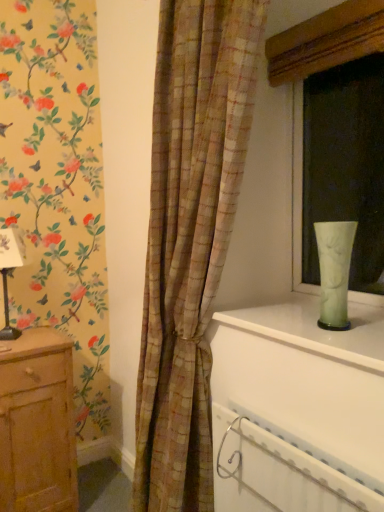
Question: Can you confirm if wooden chest of drawers at left is bigger than plaid fabric curtain at center?

Choices:
 (A) no
 (B) yes

Answer: (A)

Question: Is wooden chest of drawers at left facing towards plaid fabric curtain at center?

Choices:
 (A) yes
 (B) no

Answer: (A)

Question: Is wooden chest of drawers at left wider than plaid fabric curtain at center?

Choices:
 (A) yes
 (B) no

Answer: (A)

Question: Is wooden chest of drawers at left thinner than plaid fabric curtain at center?

Choices:
 (A) no
 (B) yes

Answer: (A)

Question: Considering the relative positions of wooden chest of drawers at left and plaid fabric curtain at center in the image provided, is wooden chest of drawers at left in front of plaid fabric curtain at center?

Choices:
 (A) yes
 (B) no

Answer: (B)

Question: In terms of size, does white plastic radiator at lower right appear bigger or smaller than plaid fabric curtain at center?

Choices:
 (A) big
 (B) small

Answer: (B)

Question: Is point tap(279, 445) closer or farther from the camera than point tap(147, 485)?

Choices:
 (A) farther
 (B) closer

Answer: (B)

Question: From a real-world perspective, is white plastic radiator at lower right above or below plaid fabric curtain at center?

Choices:
 (A) below
 (B) above

Answer: (A)

Question: Do you think white plastic radiator at lower right is within plaid fabric curtain at center, or outside of it?

Choices:
 (A) outside
 (B) inside

Answer: (B)

Question: Is matte glass vase at right taller or shorter than wooden chest of drawers at left?

Choices:
 (A) short
 (B) tall

Answer: (B)

Question: Is matte glass vase at right inside or outside of wooden chest of drawers at left?

Choices:
 (A) outside
 (B) inside

Answer: (A)

Question: Does point (334, 22) appear closer or farther from the camera than point (46, 444)?

Choices:
 (A) closer
 (B) farther

Answer: (A)

Question: In the image, is matte glass vase at right on the left side or the right side of wooden chest of drawers at left?

Choices:
 (A) left
 (B) right

Answer: (B)

Question: Based on their positions, is green glass vase at upper right located to the left or right of white plastic radiator at lower right?

Choices:
 (A) left
 (B) right

Answer: (B)

Question: Relative to white plastic radiator at lower right, is green glass vase at upper right in front or behind?

Choices:
 (A) front
 (B) behind

Answer: (B)